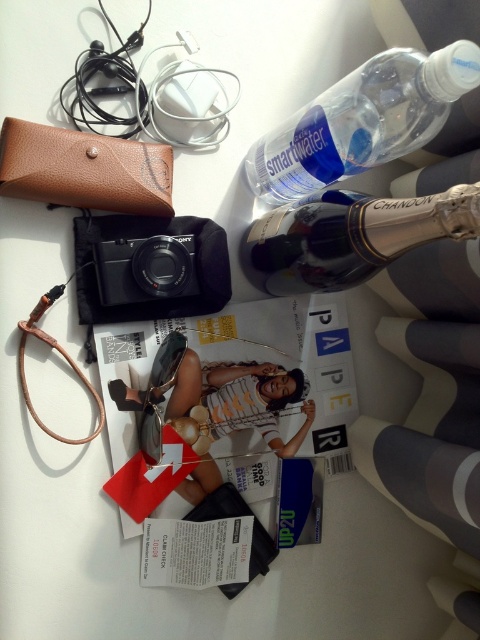
Is transparent plastic bottle at upper right above black matte camera at center?

Yes, transparent plastic bottle at upper right is above black matte camera at center.

How much distance is there between transparent plastic bottle at upper right and black matte camera at center?

8.67 inches

Describe the element at coordinates (362, 120) in the screenshot. This screenshot has height=640, width=480. I see `transparent plastic bottle at upper right` at that location.

Image resolution: width=480 pixels, height=640 pixels. I want to click on transparent plastic bottle at upper right, so click(x=362, y=120).

Which is above, shiny silver champagne bottle at upper right or black matte camera at center?

shiny silver champagne bottle at upper right is higher up.

Is point (459, 198) positioned in front of point (149, 257)?

Yes, point (459, 198) is in front of point (149, 257).

Is point (289, 211) less distant than point (135, 260)?

That is True.

Find the location of `shiny silver champagne bottle at upper right`. shiny silver champagne bottle at upper right is located at coordinates (351, 236).

Is point (288, 515) more distant than point (323, 228)?

Yes, it is behind point (323, 228).

Can you confirm if matte paper magazine at center is smaller than shiny silver champagne bottle at upper right?

Actually, matte paper magazine at center might be larger than shiny silver champagne bottle at upper right.

This screenshot has width=480, height=640. In order to click on matte paper magazine at center in this screenshot , I will do `click(239, 381)`.